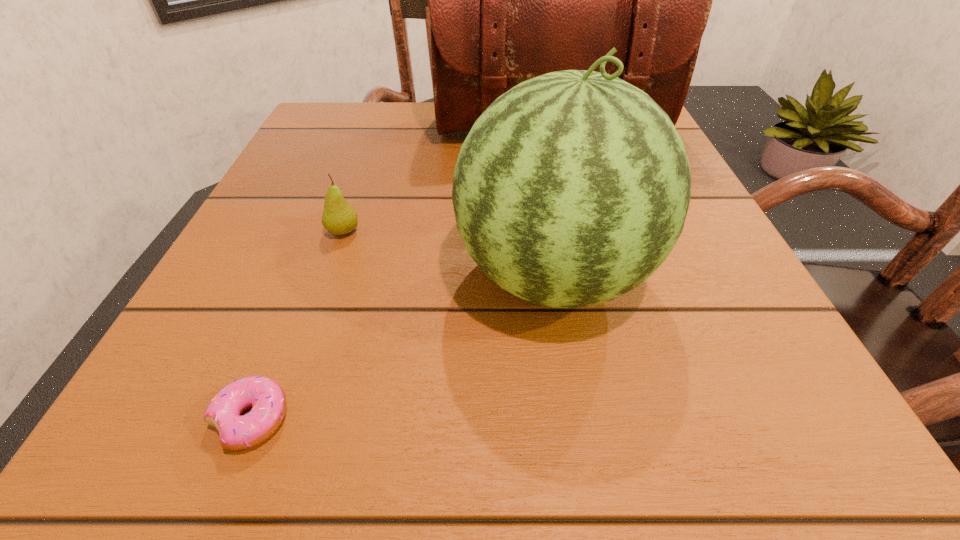
Find the location of a particular element. vacant space at the right edge of the desktop is located at coordinates (699, 317).

In the image, there is a desktop. Where is `vacant space at the far left corner`? vacant space at the far left corner is located at coordinates (x=308, y=124).

This screenshot has height=540, width=960. Find the location of `vacant region at the near left corner of the desktop`. vacant region at the near left corner of the desktop is located at coordinates (136, 413).

Locate an element on the screen. The image size is (960, 540). empty space between the pear and the watermelon is located at coordinates (448, 253).

The image size is (960, 540). I want to click on vacant region between the third tallest object and the farthest object, so click(446, 181).

This screenshot has height=540, width=960. What are the coordinates of `vacant area that lies between the nearest object and the satchel` in the screenshot? It's located at (400, 275).

You are a GUI agent. You are given a task and a screenshot of the screen. Output one action in this format:
    pyautogui.click(x=<x>, y=<y>)
    Task: Click on the free space between the farthest object and the second shortest object
    The image size is (960, 540).
    Given the screenshot: What is the action you would take?
    pyautogui.click(x=446, y=181)

The image size is (960, 540). I want to click on free space that is in between the nearest object and the second shortest object, so click(x=298, y=325).

Find the location of a particular element. empty space that is in between the watermelon and the pear is located at coordinates (448, 253).

Locate an element on the screen. free spot between the second shortest object and the doughnut is located at coordinates (298, 325).